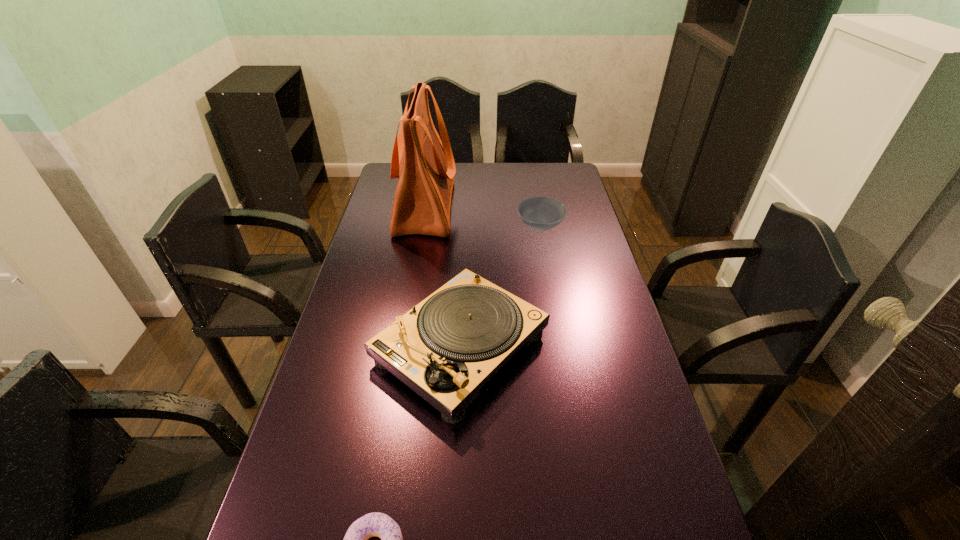
Find the location of `object present at the right edge`. object present at the right edge is located at coordinates (538, 213).

Find the location of `object that is at the far left corner`. object that is at the far left corner is located at coordinates (426, 168).

Where is `vacant point at the far edge`? vacant point at the far edge is located at coordinates (472, 170).

Where is `free location at the left edge of the desktop`? Image resolution: width=960 pixels, height=540 pixels. free location at the left edge of the desktop is located at coordinates (383, 246).

You are a GUI agent. You are given a task and a screenshot of the screen. Output one action in this format:
    pyautogui.click(x=<x>, y=<y>)
    Task: Click on the vacant space at the right edge
    This screenshot has width=960, height=540.
    Given the screenshot: What is the action you would take?
    567,268

In the image, there is a desktop. Where is `free space at the far right corner`? free space at the far right corner is located at coordinates (572, 180).

I want to click on unoccupied area between the tallest object and the second nearest object, so click(x=443, y=277).

You are a GUI agent. You are given a task and a screenshot of the screen. Output one action in this format:
    pyautogui.click(x=<x>, y=<y>)
    Task: Click on the free spot between the tallest object and the third farthest object
    This screenshot has height=540, width=960.
    Given the screenshot: What is the action you would take?
    pyautogui.click(x=443, y=277)

You are a GUI agent. You are given a task and a screenshot of the screen. Output one action in this format:
    pyautogui.click(x=<x>, y=<y>)
    Task: Click on the vacant area that lies between the tallest object and the record player
    
    Given the screenshot: What is the action you would take?
    pyautogui.click(x=443, y=277)

Locate which object is the second closest to the bowl. Please provide its 2D coordinates. Your answer should be formatted as a tuple, i.e. [(x, y)], where the tuple contains the x and y coordinates of a point satisfying the conditions above.

[(445, 348)]